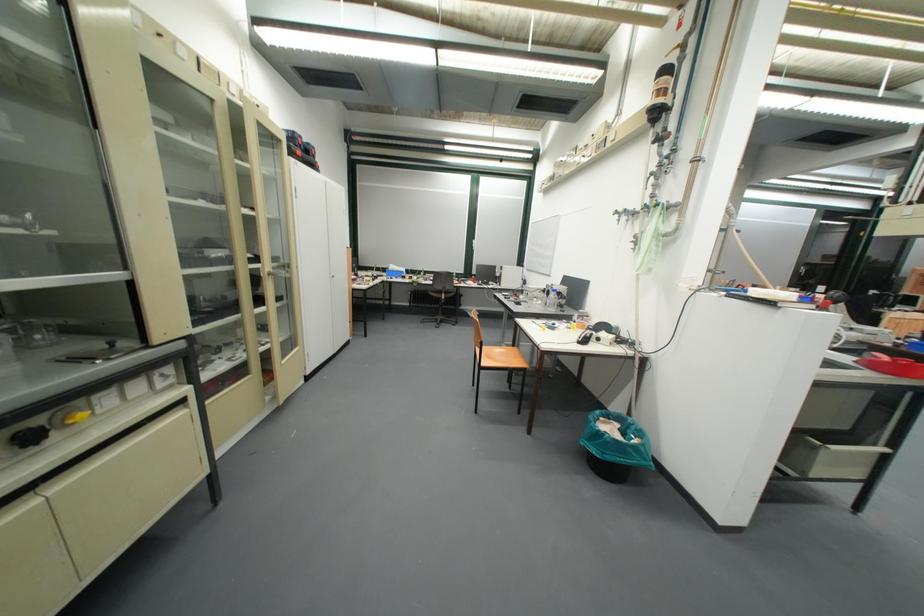
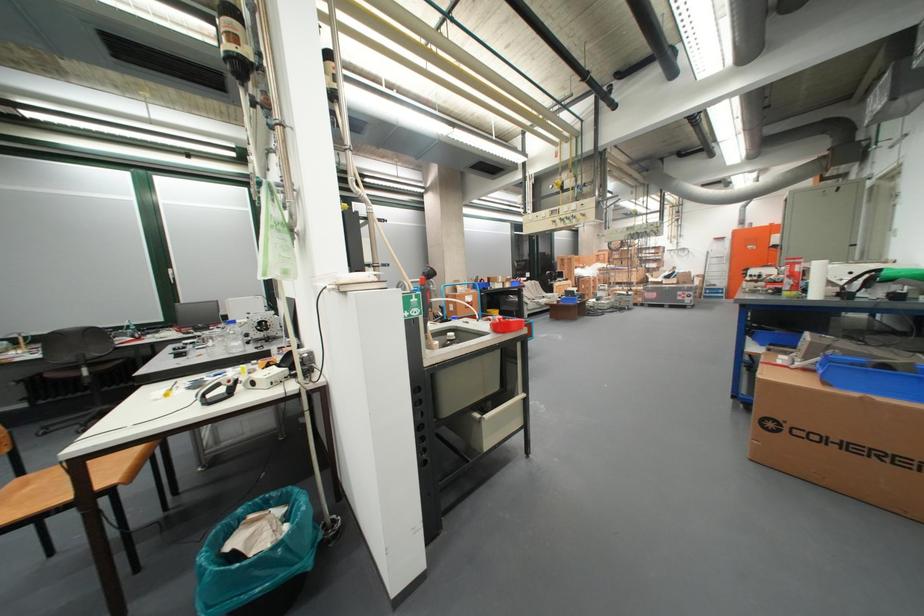
The point at (629, 426) is marked in the first image. Where is the corresponding point in the second image?

(293, 512)